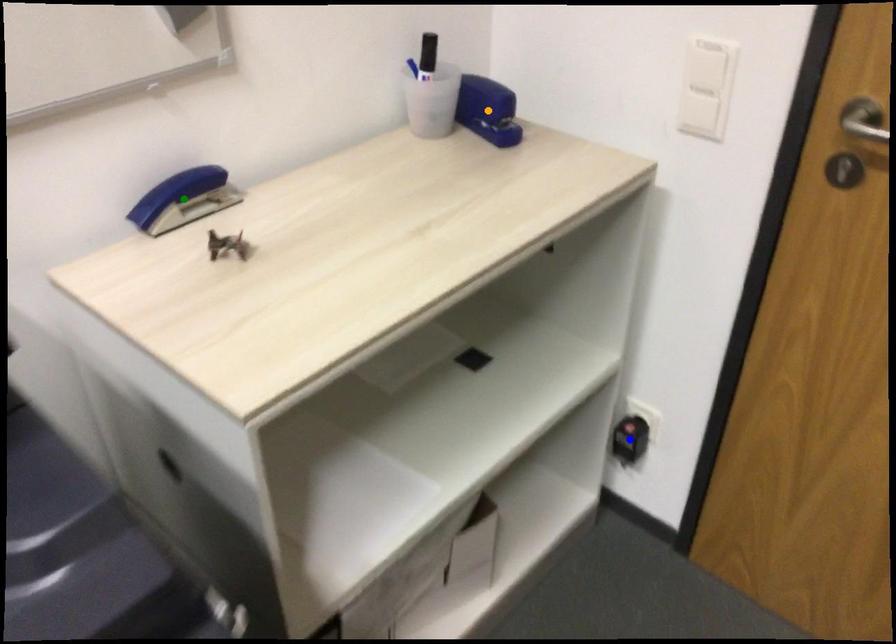
Order these from nearest to farthest:
green point, blue point, orange point

1. green point
2. orange point
3. blue point